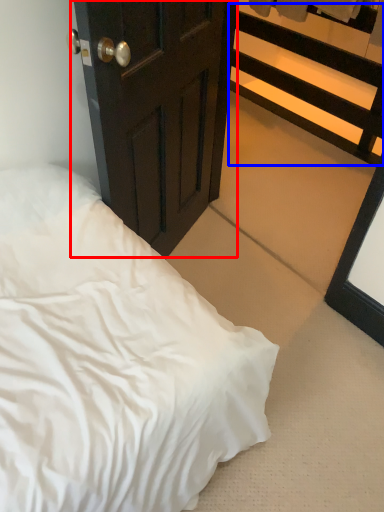
Question: Which point is closer to the camera, door (highlighted by a red box) or balustrade (highlighted by a blue box)?

Choices:
 (A) door
 (B) balustrade

Answer: (A)